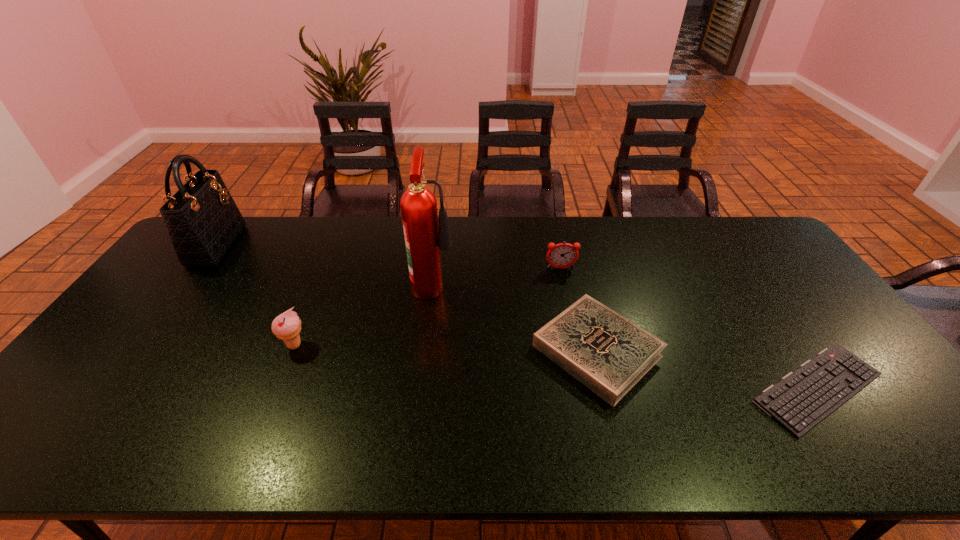
Find the location of a particular element. This screenshot has height=540, width=960. empty location between the second shortest object and the computer keyboard is located at coordinates (708, 369).

I want to click on empty location between the third tallest object and the hardback book, so click(445, 348).

This screenshot has height=540, width=960. I want to click on vacant area that lies between the icecream and the fifth shortest object, so click(255, 295).

What are the coordinates of `object that is the third closest to the fire extinguisher` in the screenshot? It's located at (287, 326).

In order to click on the third closest object to the tallest object in this screenshot , I will do `click(287, 326)`.

This screenshot has height=540, width=960. In order to click on vacant space that satisfies the following two spatial constraints: 1. on the front side of the hardback book; 2. on the left side of the second object from left to right in this screenshot , I will do `click(292, 350)`.

Where is `vacant position in the image that satisfies the following two spatial constraints: 1. on the back side of the second shortest object; 2. at the front of the handbag with visible charms`? The image size is (960, 540). vacant position in the image that satisfies the following two spatial constraints: 1. on the back side of the second shortest object; 2. at the front of the handbag with visible charms is located at coordinates (570, 245).

Where is `free space that satisfies the following two spatial constraints: 1. on the front-facing side of the alarm clock; 2. on the right side of the computer keyboard`? free space that satisfies the following two spatial constraints: 1. on the front-facing side of the alarm clock; 2. on the right side of the computer keyboard is located at coordinates (587, 388).

Find the location of `vacant area in the image that satisfies the following two spatial constraints: 1. on the back side of the computer keyboard; 2. at the nozzle of the tallest object`. vacant area in the image that satisfies the following two spatial constraints: 1. on the back side of the computer keyboard; 2. at the nozzle of the tallest object is located at coordinates (747, 283).

Image resolution: width=960 pixels, height=540 pixels. Find the location of `vacant region that satisfies the following two spatial constraints: 1. at the nozzle of the tallest object; 2. on the back side of the second shortest object`. vacant region that satisfies the following two spatial constraints: 1. at the nozzle of the tallest object; 2. on the back side of the second shortest object is located at coordinates (426, 350).